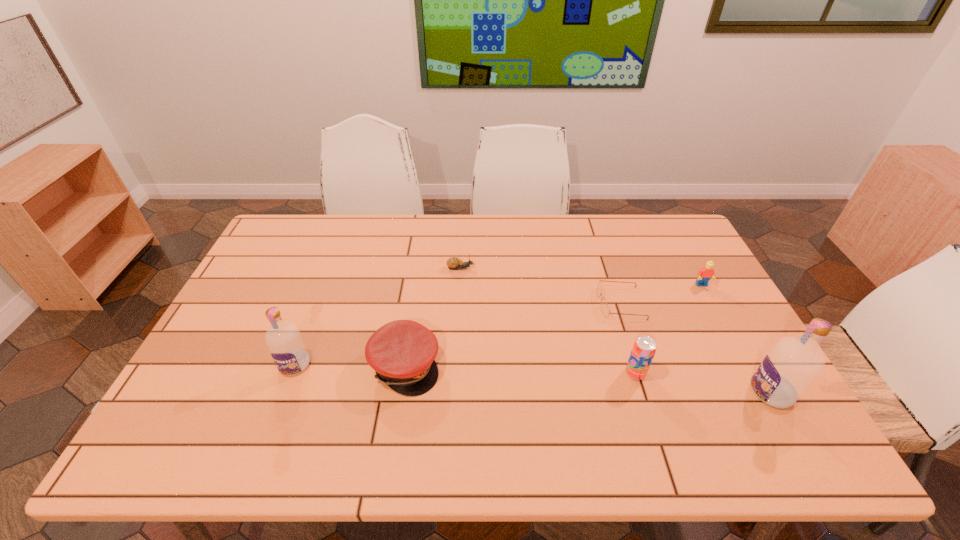
Please determine a free point for an extra vodka to ensure balance. Please provide its 2D coordinates. Your answer should be formatted as a tuple, i.e. [(x, y)], where the tuple contains the x and y coordinates of a point satisfying the conditions above.

[(526, 379)]